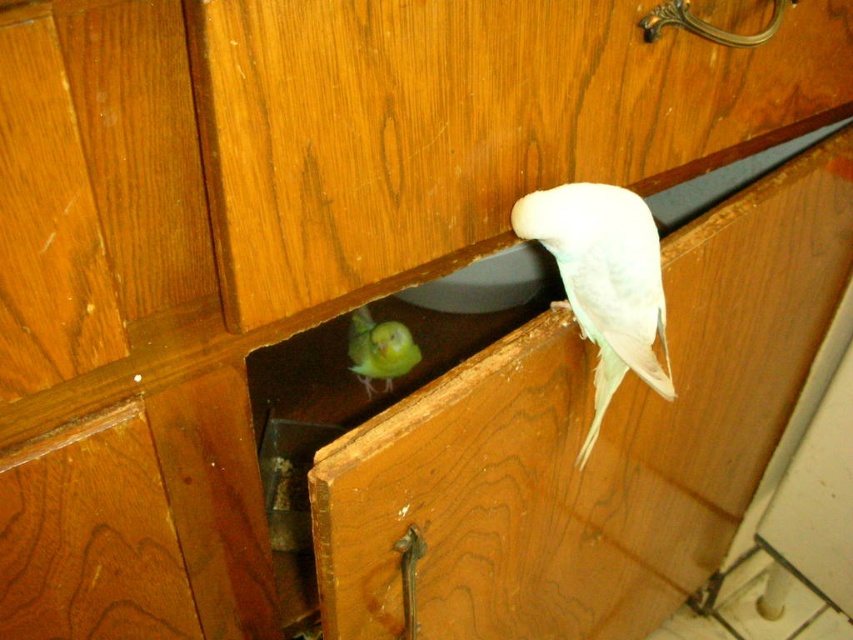
Between green matte drawer at center and green matte parrot at lower center, which one has more height?

Standing taller between the two is green matte drawer at center.

Between green matte drawer at center and green matte parrot at lower center, which one is positioned lower?

green matte drawer at center is lower down.

Measure the distance between green matte drawer at center and camera.

green matte drawer at center and camera are 18.71 inches apart.

I want to click on green matte drawer at center, so click(x=595, y=444).

Is point (775, 280) in front of point (602, 260)?

No, it is not.

Which of these two, green matte drawer at center or white feathered parrot at upper right, stands taller?

With more height is green matte drawer at center.

What do you see at coordinates (595, 444) in the screenshot?
I see `green matte drawer at center` at bounding box center [595, 444].

You are a GUI agent. You are given a task and a screenshot of the screen. Output one action in this format:
    pyautogui.click(x=<x>, y=<y>)
    Task: Click on the green matte drawer at center
    
    Given the screenshot: What is the action you would take?
    pyautogui.click(x=595, y=444)

Is white feathered parrot at upper right to the right of green matte parrot at lower center from the viewer's perspective?

Indeed, white feathered parrot at upper right is positioned on the right side of green matte parrot at lower center.

Who is positioned more to the right, white feathered parrot at upper right or green matte parrot at lower center?

From the viewer's perspective, white feathered parrot at upper right appears more on the right side.

I want to click on white feathered parrot at upper right, so click(604, 282).